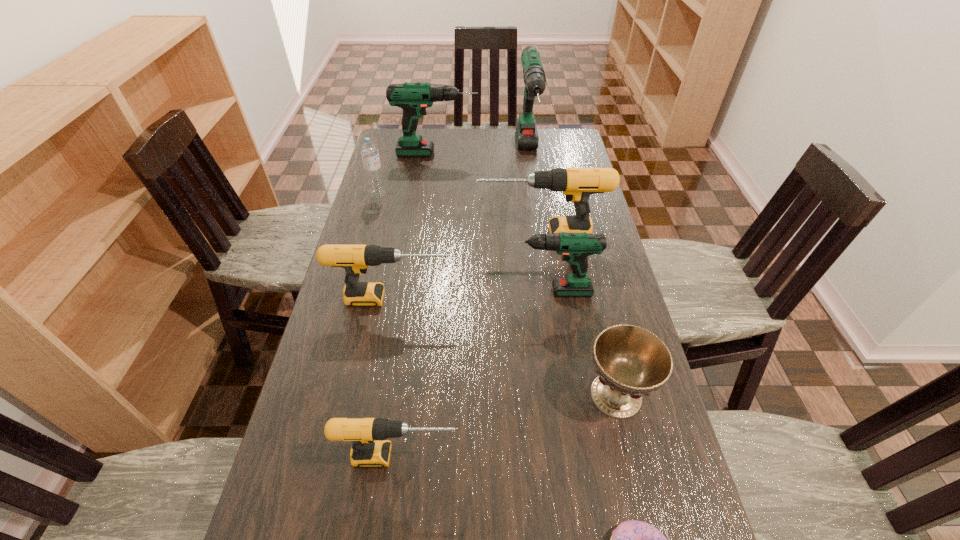
This screenshot has height=540, width=960. I want to click on the tallest object, so click(534, 76).

Identify the location of the tallest drill. (534, 76).

You are a GUI agent. You are given a task and a screenshot of the screen. Output one action in this format:
    pyautogui.click(x=<x>, y=<y>)
    Task: Click on the second smallest green drill
    
    Given the screenshot: What is the action you would take?
    pyautogui.click(x=414, y=98)

Identify the location of the sixth nearest object. The height and width of the screenshot is (540, 960). (577, 184).

Locate an element on the screen. This screenshot has height=540, width=960. the biggest black drill is located at coordinates (577, 184).

Locate an element on the screen. the third farthest object is located at coordinates (369, 151).

Where is `the smallest green drill`? The image size is (960, 540). the smallest green drill is located at coordinates (575, 247).

I want to click on the second nearest black drill, so click(355, 259).

Where is `red chalice`? Image resolution: width=960 pixels, height=540 pixels. red chalice is located at coordinates (631, 361).

Locate an element on the screen. chalice is located at coordinates (631, 361).